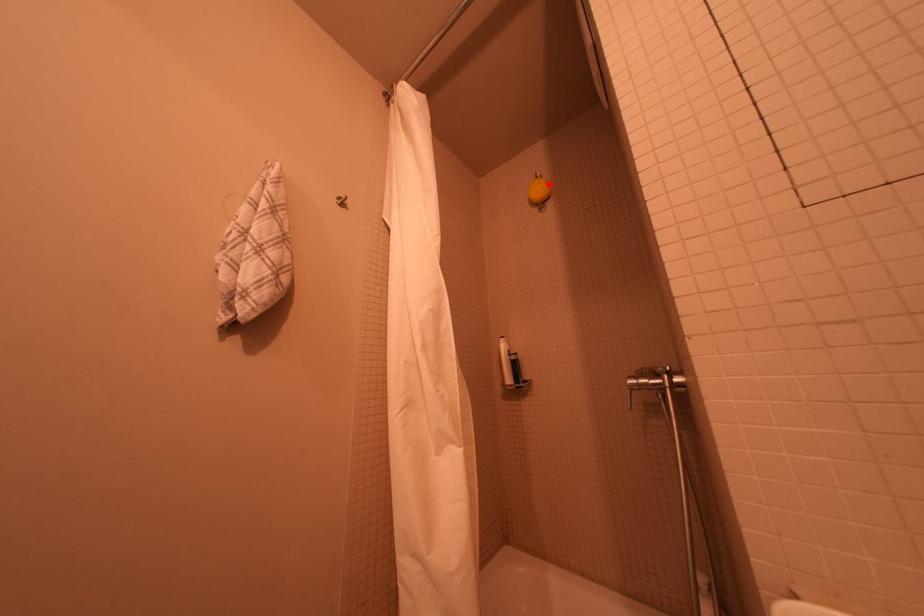
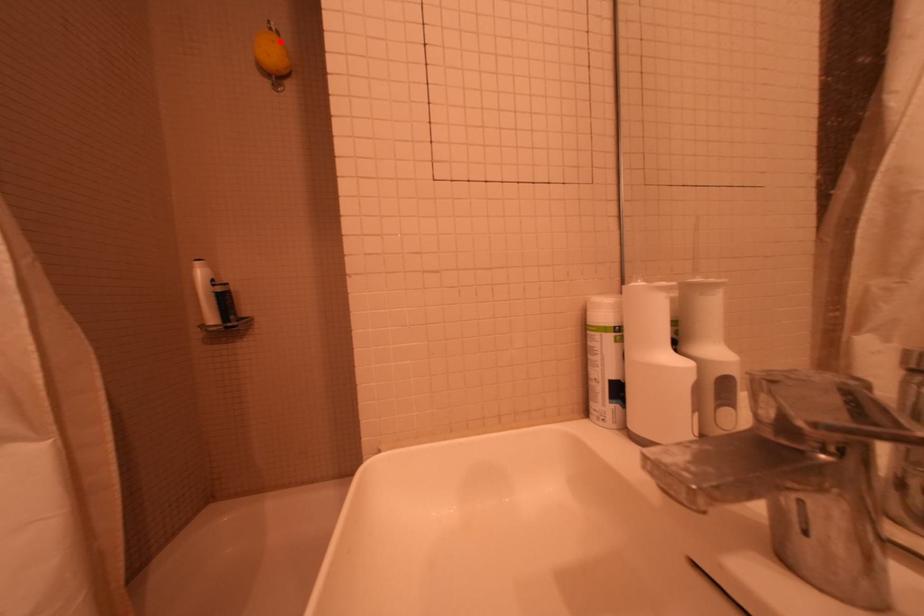
In the scene shown: I am providing you with two images of the same scene from different viewpoints. A red point is marked on the first image and another point is marked on the second image. Is the marked point in image1 the same physical position as the marked point in image2?

Yes